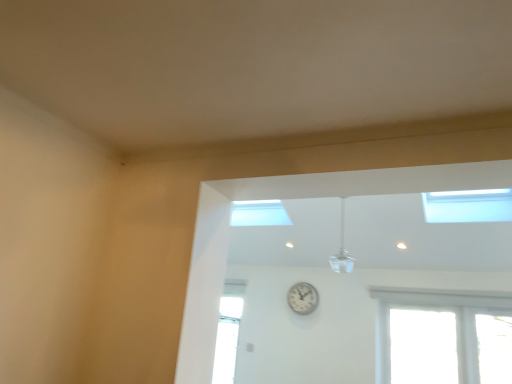
Question: From a real-world perspective, is white metallic clock at center located higher than transparent glass window at upper right?

Choices:
 (A) no
 (B) yes

Answer: (A)

Question: Is white metallic clock at center to the left of transparent glass window at upper right from the viewer's perspective?

Choices:
 (A) no
 (B) yes

Answer: (B)

Question: Does white metallic clock at center appear on the right side of transparent glass window at upper right?

Choices:
 (A) yes
 (B) no

Answer: (B)

Question: From a real-world perspective, is white metallic clock at center located beneath transparent glass window at upper right?

Choices:
 (A) no
 (B) yes

Answer: (B)

Question: Does white metallic clock at center have a larger size compared to transparent glass window at upper right?

Choices:
 (A) yes
 (B) no

Answer: (B)

Question: Can you confirm if white metallic clock at center is smaller than transparent glass window at upper right?

Choices:
 (A) yes
 (B) no

Answer: (A)

Question: Considering the relative sizes of transparent glass window at upper right and white metallic clock at center in the image provided, is transparent glass window at upper right taller than white metallic clock at center?

Choices:
 (A) no
 (B) yes

Answer: (A)

Question: From a real-world perspective, is transparent glass window at upper right below white metallic clock at center?

Choices:
 (A) no
 (B) yes

Answer: (A)

Question: Does transparent glass window at upper right have a lesser height compared to white metallic clock at center?

Choices:
 (A) no
 (B) yes

Answer: (B)

Question: Is transparent glass window at upper right to the right of white metallic clock at center from the viewer's perspective?

Choices:
 (A) no
 (B) yes

Answer: (B)

Question: Is transparent glass window at upper right aimed at white metallic clock at center?

Choices:
 (A) no
 (B) yes

Answer: (A)

Question: Is transparent glass window at upper right in contact with white metallic clock at center?

Choices:
 (A) yes
 (B) no

Answer: (B)

Question: Is white metallic clock at center positioned beyond the bounds of white glossy ceiling fan at upper center?

Choices:
 (A) no
 (B) yes

Answer: (B)